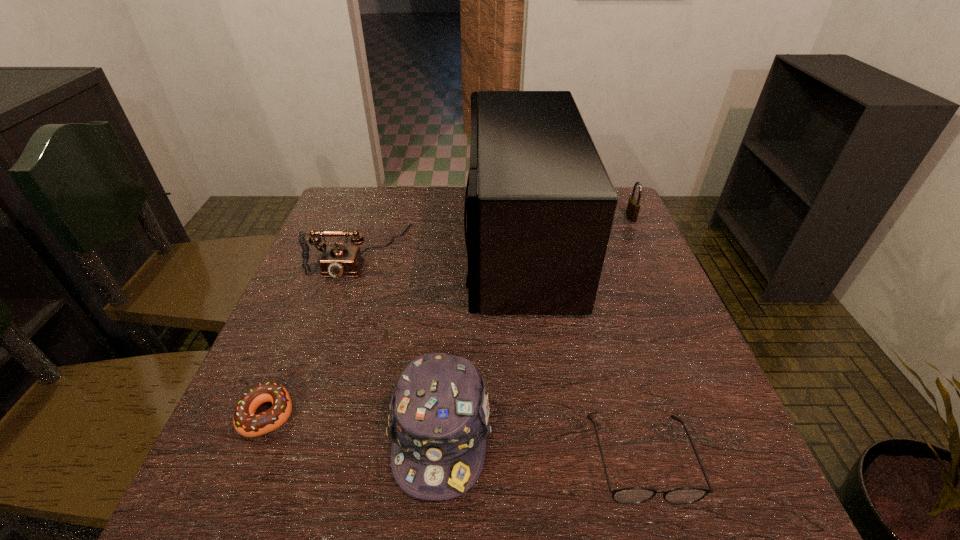
The image size is (960, 540). I want to click on microwave_oven, so click(540, 208).

Where is `telephone`? Image resolution: width=960 pixels, height=540 pixels. telephone is located at coordinates (336, 261).

Identify the location of the rightmost object. The width and height of the screenshot is (960, 540). (633, 206).

Locate an element on the screen. This screenshot has height=540, width=960. headwear is located at coordinates (438, 422).

Identify the location of spectacles. The height and width of the screenshot is (540, 960). (633, 495).

Identify the location of the shortest object. (247, 423).

Image resolution: width=960 pixels, height=540 pixels. Find the location of `vacant space situated 0.260m on the front-facing side of the microwave_oven`. vacant space situated 0.260m on the front-facing side of the microwave_oven is located at coordinates (371, 242).

Find the location of a particular element. vacant region located 0.270m on the front-facing side of the microwave_oven is located at coordinates tap(367, 242).

At what (x,y) coordinates should I click in order to perform the action: click on free location located on the front-facing side of the microwave_oven. Please return your answer as a coordinate pair (x, y). This screenshot has width=960, height=540. Looking at the image, I should click on 345,242.

The height and width of the screenshot is (540, 960). In order to click on free space located on the dial of the telephone in this screenshot , I will do `click(316, 382)`.